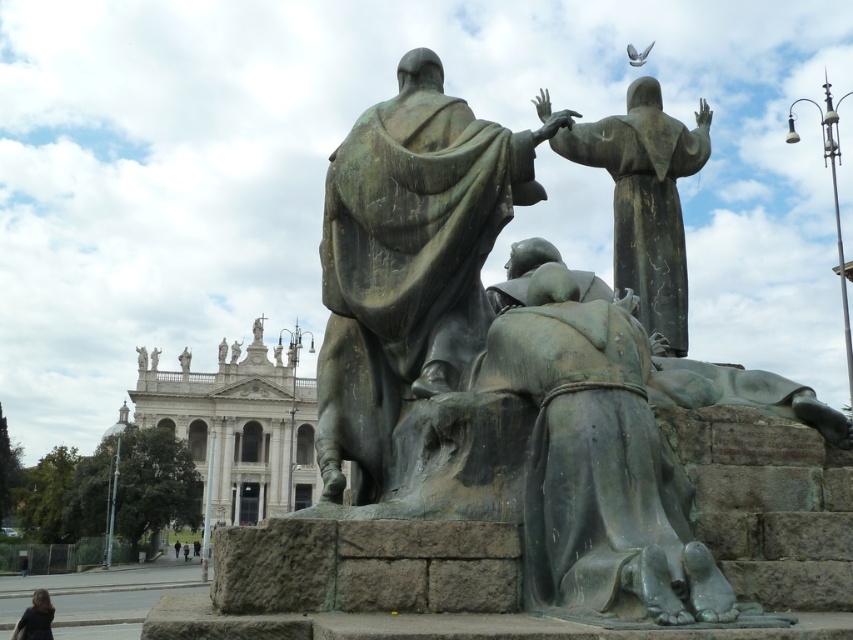
Consider the image. You are a tour guide giving a virtual tour of the plaza. You want to direct visitors to the bronze statue at center. Using the coordinate system where the bottom left corner is the origin, can you confirm if the statue is closer to the top or bottom of the image?

The bronze statue at center is located at point (408, 260). Since the y coordinate is 0.479, which is less than 0.5, it is closer to the bottom of the image.